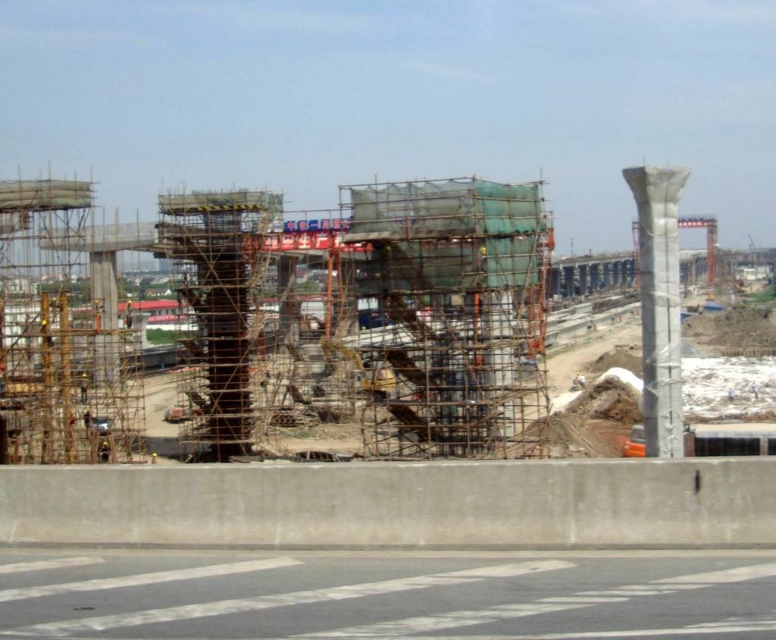
Question: Is white concrete pillar at right below gray metallic crane at center?

Choices:
 (A) yes
 (B) no

Answer: (A)

Question: Is white concrete pillar at right to the left of gray metallic crane at center from the viewer's perspective?

Choices:
 (A) yes
 (B) no

Answer: (A)

Question: Does white concrete pillar at right have a greater width compared to gray metallic crane at center?

Choices:
 (A) no
 (B) yes

Answer: (A)

Question: Among these points, which one is nearest to the camera?

Choices:
 (A) (638, 193)
 (B) (705, 216)

Answer: (A)

Question: Which point is closer to the camera taking this photo?

Choices:
 (A) (646, 211)
 (B) (712, 250)

Answer: (A)